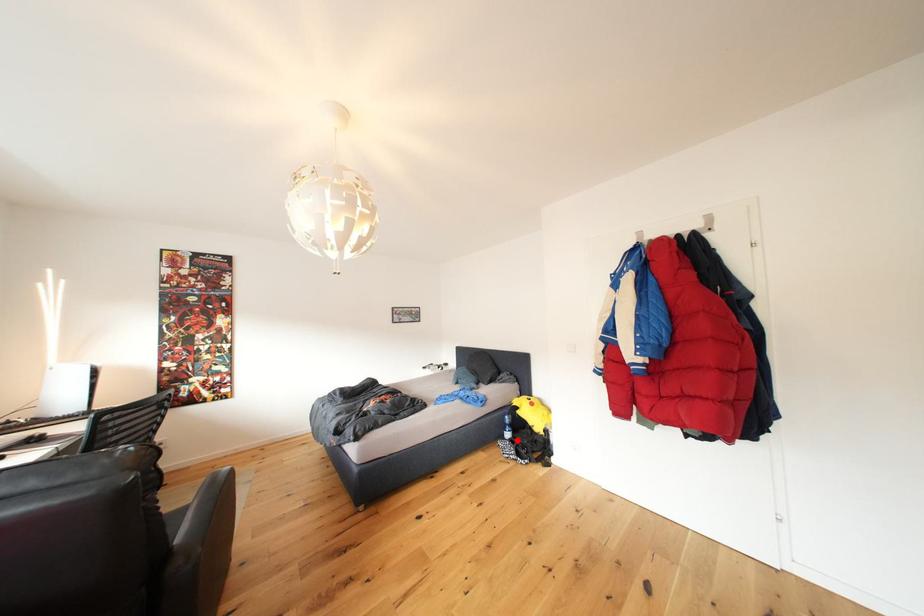
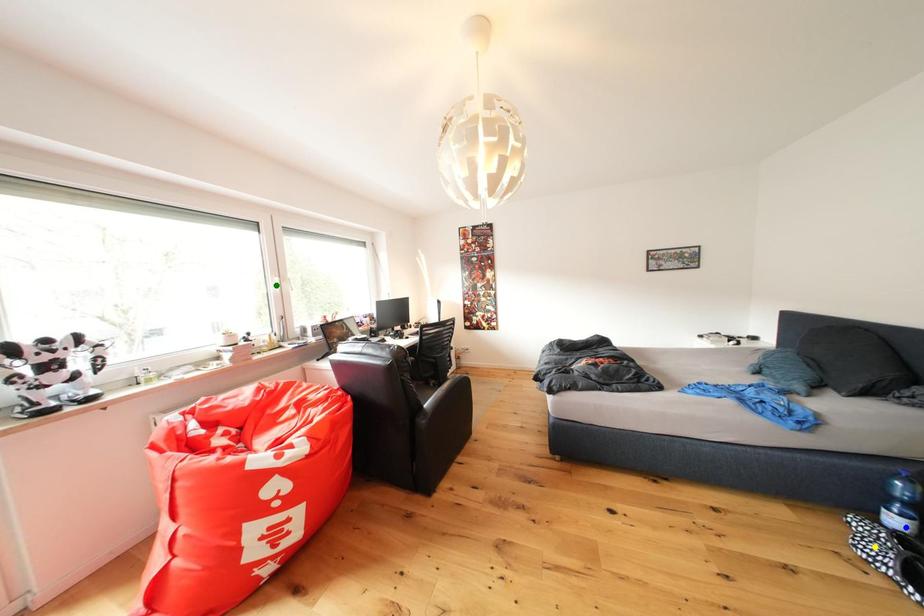
Question: I am providing you with two images of the same scene from different viewpoints. A red point is marked on the first image. You are given multiple points on the second image. Which point in image 2 is actually the same real-world point as the red point in image 1?

Choices:
 (A) blue point
 (B) green point
 (C) yellow point

Answer: (A)